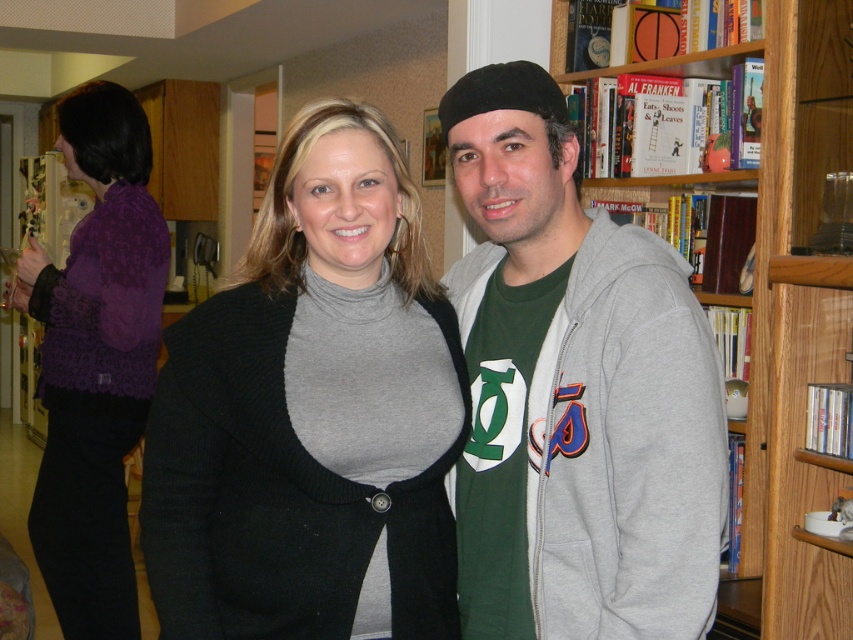
You are a delivery person who needs to place a large package on a surface that can support its weight. The wooden bookcase at right and the purple lace sweater at left are the only options available. Which object should you choose?

The wooden bookcase at right should be chosen because it is a sturdy structure designed to hold items, unlike the purple lace sweater at left which is a delicate garment and cannot support heavy objects.

You are a fashion stylist trying to create a layered look. You have the knit gray turtleneck at center and the purple lace sweater at left. Which item should you place on top to achieve a layered outfit?

The knit gray turtleneck at center should be placed on top of the purple lace sweater at left because it is located above it in the image.